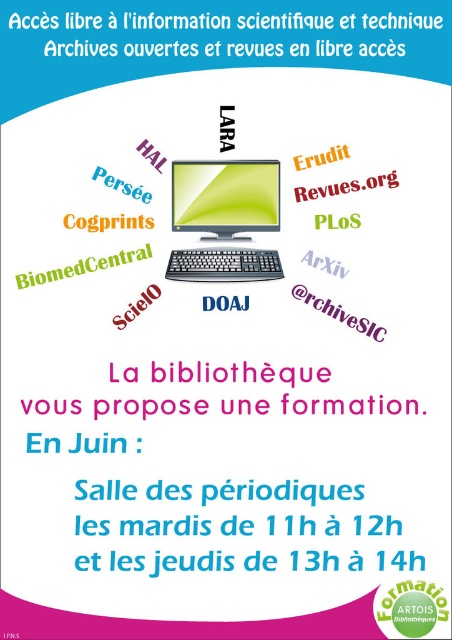
You are a participant at the library training session and want to reach the black plastic keyboard at center to type a query. However, there is a white paper at upper center in the way. Can you easily access the keyboard without moving the paper?

The white paper at upper center is further to the viewer than the black plastic keyboard at center, so the keyboard is closer to you. Therefore, you can easily access the black plastic keyboard at center without moving the white paper at upper center.

You are a graphic designer reviewing this poster and need to adjust the layout. If you want to move the white paper at upper center closer to the matte black monitor at center, which direction should you move it?

The matte black monitor at center is currently closer to the viewer than the white paper at upper center. To move the white paper at upper center closer to the matte black monitor at center, you should move it forward towards the viewer.

Consider the image. You are standing in front of the library poster and want to touch the point at coordinates point (x=193, y=28). If your hand can reach up to 5 feet, will you be able to reach it?

The distance of point (x=193, y=28) from camera is 5.95 feet. Since your hand can only reach up to 5 feet, you cannot reach the point at point (x=193, y=28).